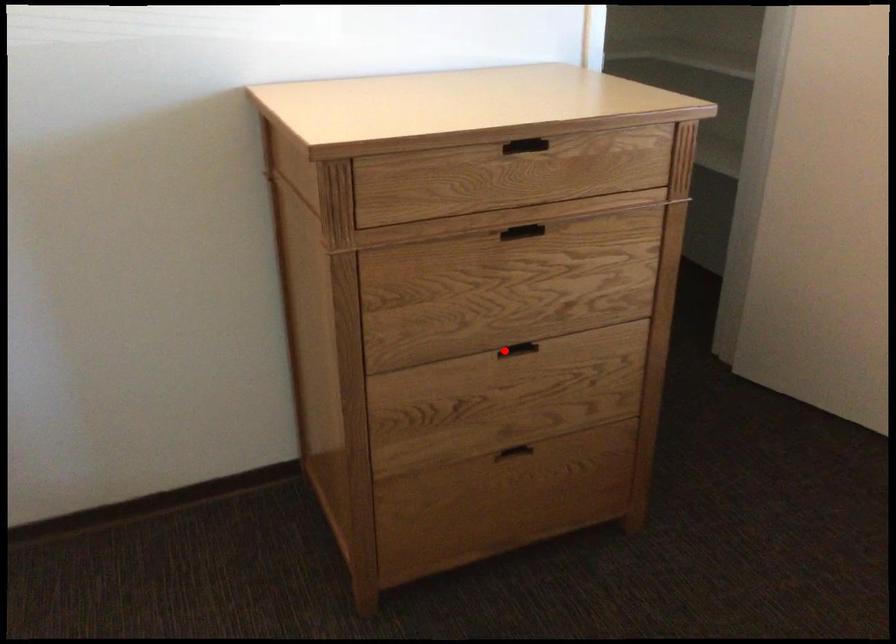
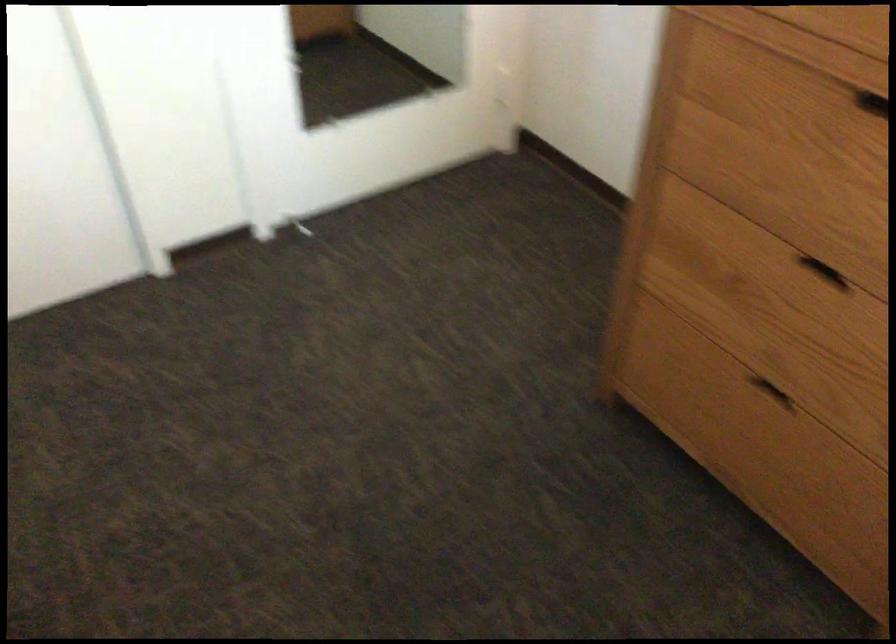
Question: I am providing you with two images of the same scene from different viewpoints. Given a red point in image1, look at the same physical point in image2. Is it:

Choices:
 (A) Closer to the viewpoint
 (B) Farther from the viewpoint

Answer: (A)